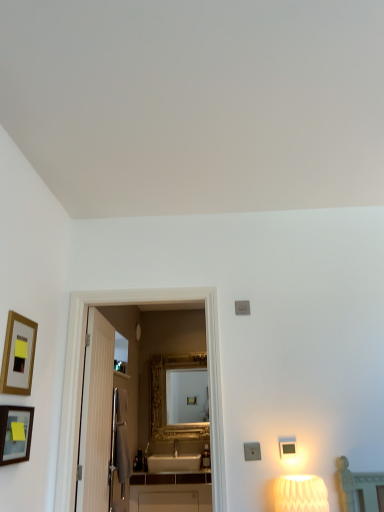
Measure the distance between gold ornate mirror at center and camera.

gold ornate mirror at center is 16.71 feet from camera.

What is the approximate height of gold ornate mirror at center?

gold ornate mirror at center is 38.04 inches tall.

The height and width of the screenshot is (512, 384). What do you see at coordinates (300, 494) in the screenshot? I see `white textured lampshade at lower right` at bounding box center [300, 494].

In order to face white textured lampshade at lower right, should I rotate leftwards or rightwards?

Rotate right and turn 14.651 degrees.

Image resolution: width=384 pixels, height=512 pixels. I want to click on gold-framed picture at left, positioned as the 1th picture frame in top-to-bottom order, so click(x=18, y=355).

What do you see at coordinates (171, 498) in the screenshot? This screenshot has width=384, height=512. I see `white glossy cabinet at center` at bounding box center [171, 498].

I want to click on gold ornate mirror at center, so click(x=166, y=400).

Can you tell me how much gold-framed picture at left, which ranks as the second picture frame in bottom-to-top order, and gold ornate mirror at center differ in facing direction?

They differ by 90.1 degrees in their facing directions.

Can you confirm if gold-framed picture at left, positioned as the 1th picture frame in top-to-bottom order, is thinner than gold ornate mirror at center?

Indeed, gold-framed picture at left, positioned as the 1th picture frame in top-to-bottom order, has a lesser width compared to gold ornate mirror at center.

Is gold-framed picture at left, which ranks as the second picture frame in bottom-to-top order, looking in the opposite direction of gold ornate mirror at center?

That's not correct — gold-framed picture at left, which ranks as the second picture frame in bottom-to-top order, is not looking away from gold ornate mirror at center.

Who is shorter, gold-framed picture at left, positioned as the 1th picture frame in top-to-bottom order, or gold ornate mirror at center?

With less height is gold-framed picture at left, positioned as the 1th picture frame in top-to-bottom order.

Between matte gold picture frame at left, placed as the 2th picture frame when sorted from top to bottom, and gold ornate mirror at center, which one has smaller size?

matte gold picture frame at left, placed as the 2th picture frame when sorted from top to bottom, is smaller.

Does matte gold picture frame at left, which ranks as the 1th picture frame in bottom-to-top order, touch gold ornate mirror at center?

No, matte gold picture frame at left, which ranks as the 1th picture frame in bottom-to-top order, is not next to gold ornate mirror at center.

Is matte gold picture frame at left, which ranks as the 1th picture frame in bottom-to-top order, oriented towards gold ornate mirror at center?

No, matte gold picture frame at left, which ranks as the 1th picture frame in bottom-to-top order, is not turned towards gold ornate mirror at center.

Is gold-framed picture at left, positioned as the 1th picture frame in top-to-bottom order, positioned far away from matte gold picture frame at left, which ranks as the 1th picture frame in bottom-to-top order?

No, gold-framed picture at left, positioned as the 1th picture frame in top-to-bottom order, is not far from matte gold picture frame at left, which ranks as the 1th picture frame in bottom-to-top order.

Considering the relative sizes of gold-framed picture at left, positioned as the 1th picture frame in top-to-bottom order, and matte gold picture frame at left, which ranks as the 1th picture frame in bottom-to-top order, in the image provided, is gold-framed picture at left, positioned as the 1th picture frame in top-to-bottom order, taller than matte gold picture frame at left, which ranks as the 1th picture frame in bottom-to-top order,?

Yes, gold-framed picture at left, positioned as the 1th picture frame in top-to-bottom order, is taller than matte gold picture frame at left, which ranks as the 1th picture frame in bottom-to-top order.

Is gold-framed picture at left, positioned as the 1th picture frame in top-to-bottom order, positioned beyond the bounds of matte gold picture frame at left, placed as the 2th picture frame when sorted from top to bottom?

Yes, gold-framed picture at left, positioned as the 1th picture frame in top-to-bottom order, is located beyond the bounds of matte gold picture frame at left, placed as the 2th picture frame when sorted from top to bottom.

From a real-world perspective, between gold-framed picture at left, which ranks as the second picture frame in bottom-to-top order, and matte gold picture frame at left, placed as the 2th picture frame when sorted from top to bottom, who is vertically lower?

From a 3D spatial view, matte gold picture frame at left, placed as the 2th picture frame when sorted from top to bottom, is below.

Which is more to the left, white glossy cabinet at center or white textured lampshade at lower right?

From the viewer's perspective, white glossy cabinet at center appears more on the left side.

Is white glossy cabinet at center behind white textured lampshade at lower right?

Yes, the depth of white glossy cabinet at center is greater than that of white textured lampshade at lower right.

From the picture: Is white glossy cabinet at center not inside white textured lampshade at lower right?

Yes, white glossy cabinet at center is located beyond the bounds of white textured lampshade at lower right.

Considering the positions of objects white textured lampshade at lower right and white glossy cabinet at center in the image provided, who is behind, white textured lampshade at lower right or white glossy cabinet at center?

white glossy cabinet at center.

Considering the relative sizes of white textured lampshade at lower right and white glossy cabinet at center in the image provided, is white textured lampshade at lower right bigger than white glossy cabinet at center?

Actually, white textured lampshade at lower right might be smaller than white glossy cabinet at center.

Consider the image. From a real-world perspective, is white textured lampshade at lower right positioned above or below white glossy cabinet at center?

white textured lampshade at lower right is above white glossy cabinet at center.

From the image's perspective, is white textured lampshade at lower right on top of white glossy cabinet at center?

Yes, from the image's perspective, white textured lampshade at lower right is on top of white glossy cabinet at center.

Which of these two, white glossy cabinet at center or gold-framed picture at left, positioned as the 1th picture frame in top-to-bottom order, is thinner?

gold-framed picture at left, positioned as the 1th picture frame in top-to-bottom order, is thinner.

Which object is further away from the camera, white glossy cabinet at center or gold-framed picture at left, positioned as the 1th picture frame in top-to-bottom order?

Positioned behind is white glossy cabinet at center.

Does white glossy cabinet at center have a smaller size compared to gold-framed picture at left, which ranks as the second picture frame in bottom-to-top order?

No.

Which object is positioned more to the right, white glossy cabinet at center or gold-framed picture at left, positioned as the 1th picture frame in top-to-bottom order?

white glossy cabinet at center is more to the right.

Considering the positions of objects gold-framed picture at left, which ranks as the second picture frame in bottom-to-top order, and white textured lampshade at lower right in the image provided, who is more to the right, gold-framed picture at left, which ranks as the second picture frame in bottom-to-top order, or white textured lampshade at lower right?

white textured lampshade at lower right.

How different are the orientations of gold-framed picture at left, positioned as the 1th picture frame in top-to-bottom order, and white textured lampshade at lower right in degrees?

The angle between the facing direction of gold-framed picture at left, positioned as the 1th picture frame in top-to-bottom order, and the facing direction of white textured lampshade at lower right is 90.3 degrees.

Is gold-framed picture at left, which ranks as the second picture frame in bottom-to-top order, not inside white textured lampshade at lower right?

Yes, gold-framed picture at left, which ranks as the second picture frame in bottom-to-top order, is located beyond the bounds of white textured lampshade at lower right.

From the image's perspective, who appears lower, gold-framed picture at left, positioned as the 1th picture frame in top-to-bottom order, or white textured lampshade at lower right?

white textured lampshade at lower right appears lower in the image.

From the gold ornate mirror at center, count the 2nd picture frame to the left and point to it. Please provide its 2D coordinates.

[(18, 355)]

Find the location of `mirror above the matte gold picture frame at left, which ranks as the 1th picture frame in bottom-to-top order (from a real-world perspective)`. mirror above the matte gold picture frame at left, which ranks as the 1th picture frame in bottom-to-top order (from a real-world perspective) is located at coordinates (166, 400).

Looking at the image, which one is located closer to white glossy cabinet at center, gold ornate mirror at center or white textured lampshade at lower right?

Among the two, gold ornate mirror at center is located nearer to white glossy cabinet at center.

Looking at the image, which one is located closer to white glossy cabinet at center, matte gold picture frame at left, placed as the 2th picture frame when sorted from top to bottom, or white textured lampshade at lower right?

Based on the image, white textured lampshade at lower right appears to be nearer to white glossy cabinet at center.

When comparing their distances from white glossy cabinet at center, does gold-framed picture at left, which ranks as the second picture frame in bottom-to-top order, or gold ornate mirror at center seem closer?

gold ornate mirror at center is positioned closer to the anchor white glossy cabinet at center.

From the image, which object appears to be farther from white glossy cabinet at center, gold ornate mirror at center or gold-framed picture at left, positioned as the 1th picture frame in top-to-bottom order?

gold-framed picture at left, positioned as the 1th picture frame in top-to-bottom order, lies further to white glossy cabinet at center than the other object.

Considering their positions, is matte gold picture frame at left, which ranks as the 1th picture frame in bottom-to-top order, positioned further to gold ornate mirror at center than gold-framed picture at left, positioned as the 1th picture frame in top-to-bottom order?

gold-framed picture at left, positioned as the 1th picture frame in top-to-bottom order, is further to gold ornate mirror at center.

Which object lies further to the anchor point gold ornate mirror at center, gold-framed picture at left, positioned as the 1th picture frame in top-to-bottom order, or matte gold picture frame at left, placed as the 2th picture frame when sorted from top to bottom?

gold-framed picture at left, positioned as the 1th picture frame in top-to-bottom order, is positioned further to the anchor gold ornate mirror at center.

Looking at the image, which one is located further to gold-framed picture at left, positioned as the 1th picture frame in top-to-bottom order, white textured lampshade at lower right or gold ornate mirror at center?

gold ornate mirror at center lies further to gold-framed picture at left, positioned as the 1th picture frame in top-to-bottom order, than the other object.

When comparing their distances from white glossy cabinet at center, does matte gold picture frame at left, placed as the 2th picture frame when sorted from top to bottom, or gold ornate mirror at center seem further?

Based on the image, matte gold picture frame at left, placed as the 2th picture frame when sorted from top to bottom, appears to be further to white glossy cabinet at center.

Identify the location of lamp between matte gold picture frame at left, which ranks as the 1th picture frame in bottom-to-top order, and white glossy cabinet at center in the front-back direction. (300, 494).

You are a GUI agent. You are given a task and a screenshot of the screen. Output one action in this format:
    pyautogui.click(x=<x>, y=<y>)
    Task: Click on the picture frame between gold-framed picture at left, positioned as the 1th picture frame in top-to-bottom order, and white textured lampshade at lower right
    
    Given the screenshot: What is the action you would take?
    pyautogui.click(x=15, y=434)

The image size is (384, 512). What are the coordinates of `cabinetry positioned between white textured lampshade at lower right and gold ornate mirror at center from near to far` in the screenshot? It's located at (171, 498).

Identify the location of picture frame located between matte gold picture frame at left, placed as the 2th picture frame when sorted from top to bottom, and white glossy cabinet at center in the depth direction. The image size is (384, 512). (18, 355).